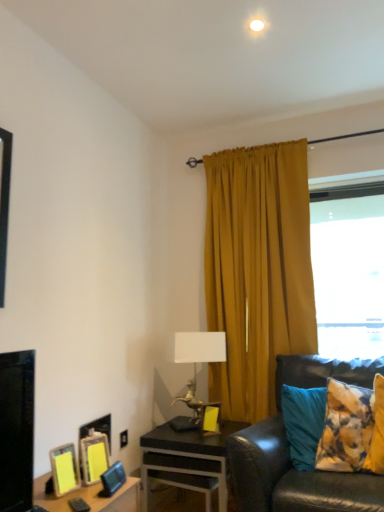
This screenshot has width=384, height=512. What are the coordinates of `vacant area in front of yellow matte picture frame at center, which appears as the 5th picture frame when viewed from the front` in the screenshot? It's located at (212, 439).